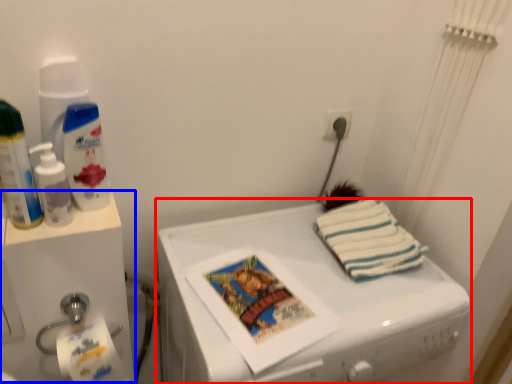
Question: Which of the following is the farthest to the observer, machine (highlighted by a red box) or water cooler (highlighted by a blue box)?

Choices:
 (A) machine
 (B) water cooler

Answer: (B)